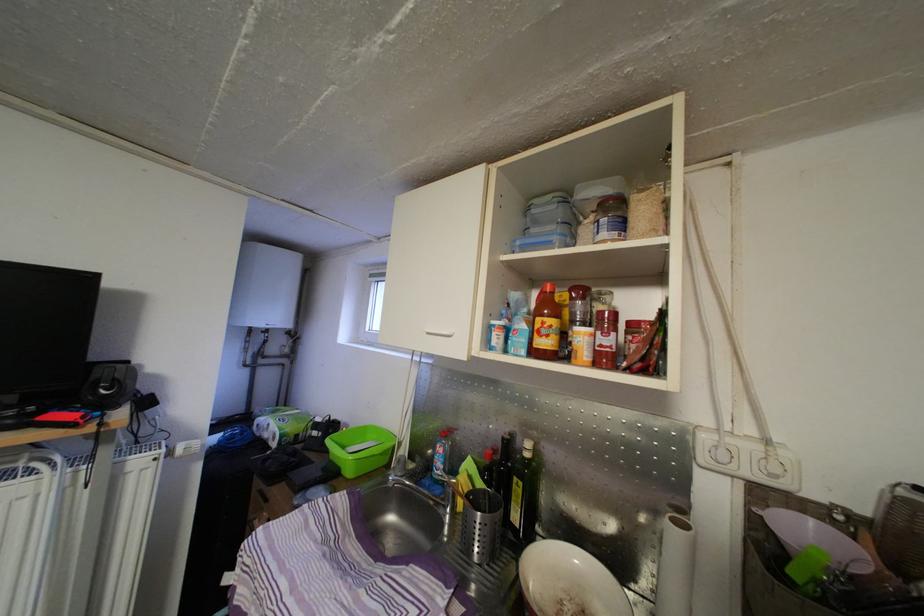
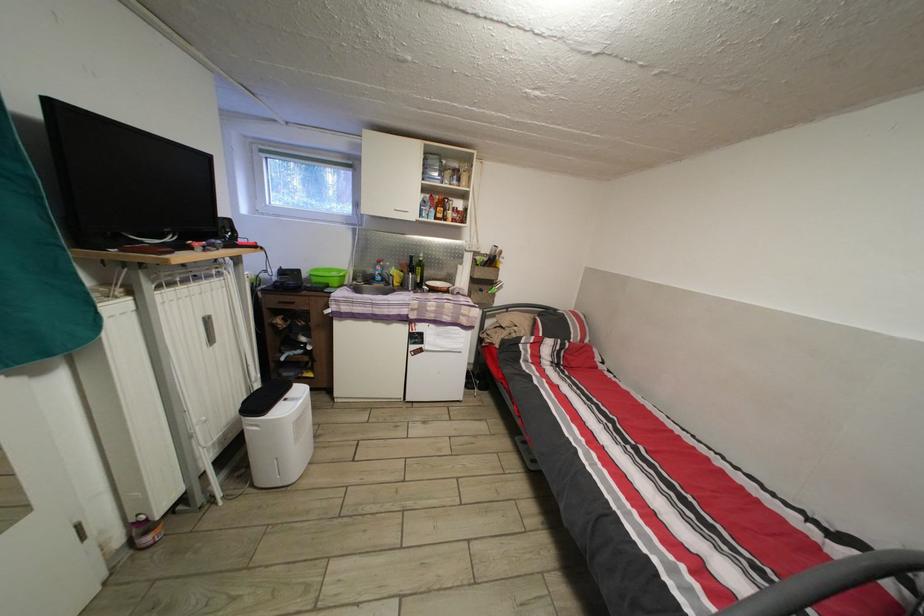
Find the pixel in the second image that matches point (379, 283) in the first image.

(269, 156)